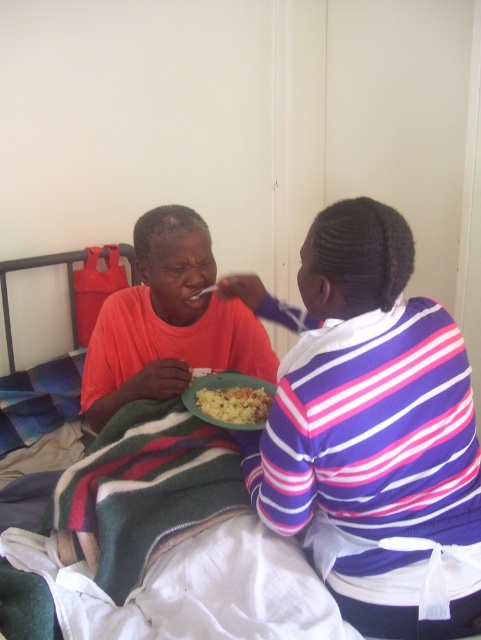
Does striped wool blanket at lower left have a greater width compared to yellowish matte food at center?

Indeed, striped wool blanket at lower left has a greater width compared to yellowish matte food at center.

Does striped wool blanket at lower left have a smaller size compared to yellowish matte food at center?

Actually, striped wool blanket at lower left might be larger than yellowish matte food at center.

Which is behind, point (129, 573) or point (271, 392)?

The point (271, 392) is behind.

Where is `striped wool blanket at lower left`? striped wool blanket at lower left is located at coordinates (143, 492).

Does matte orange shirt at left have a lesser height compared to yellowish matte food at center?

No.

Is point (178, 314) farther from camera compared to point (247, 413)?

Yes, point (178, 314) is behind point (247, 413).

Is point (200, 352) closer to viewer compared to point (227, 394)?

No, it is behind (227, 394).

You are a GUI agent. You are given a task and a screenshot of the screen. Output one action in this format:
    pyautogui.click(x=<x>, y=<y>)
    Task: Click on the matte orange shirt at left
    Image resolution: width=481 pixels, height=640 pixels.
    Given the screenshot: What is the action you would take?
    pyautogui.click(x=167, y=323)

Between purple striped shirt at upper right and striped wool blanket at lower left, which one appears on the left side from the viewer's perspective?

From the viewer's perspective, striped wool blanket at lower left appears more on the left side.

Is point (315, 256) positioned behind point (136, 547)?

No, (315, 256) is in front of (136, 547).

Measure the distance between point (455, 378) and camera.

Point (455, 378) is 38.76 inches from camera.

The image size is (481, 640). Find the location of `purple striped shirt at upper right`. purple striped shirt at upper right is located at coordinates (371, 432).